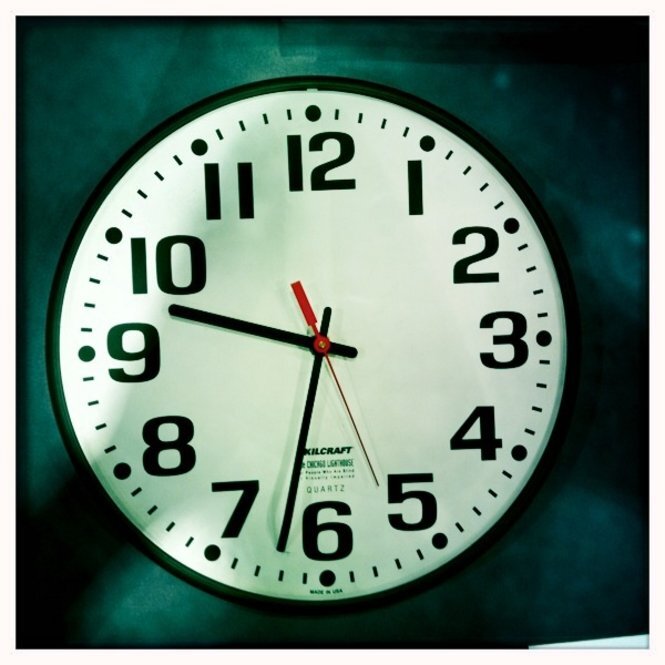
The height and width of the screenshot is (665, 665). In order to click on black trim in this screenshot , I will do `click(356, 84)`.